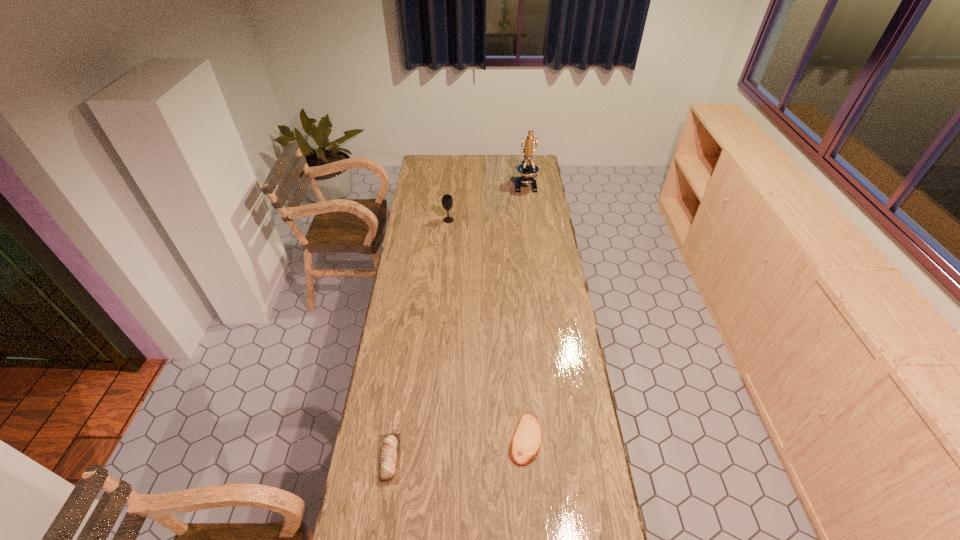
Select which object is the second closest to the leftmost object. Please provide its 2D coordinates. Your answer should be formatted as a tuple, i.e. [(x, y)], where the tuple contains the x and y coordinates of a point satisfying the conditions above.

[(447, 202)]

Find the location of a particular element. Image resolution: width=960 pixels, height=540 pixels. free space that satisfies the following two spatial constraints: 1. on the back side of the shorter pita bread; 2. on the left side of the taller pita bread is located at coordinates (393, 439).